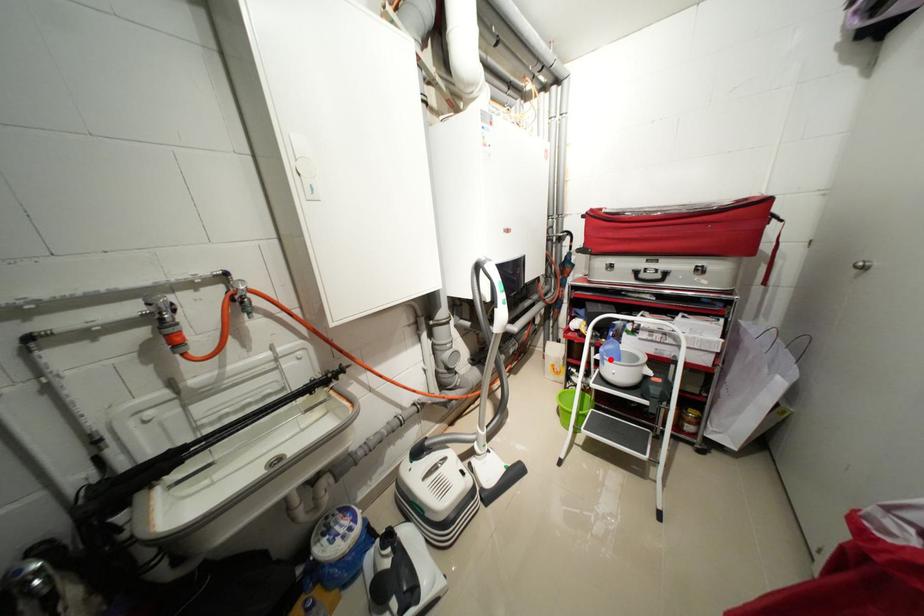
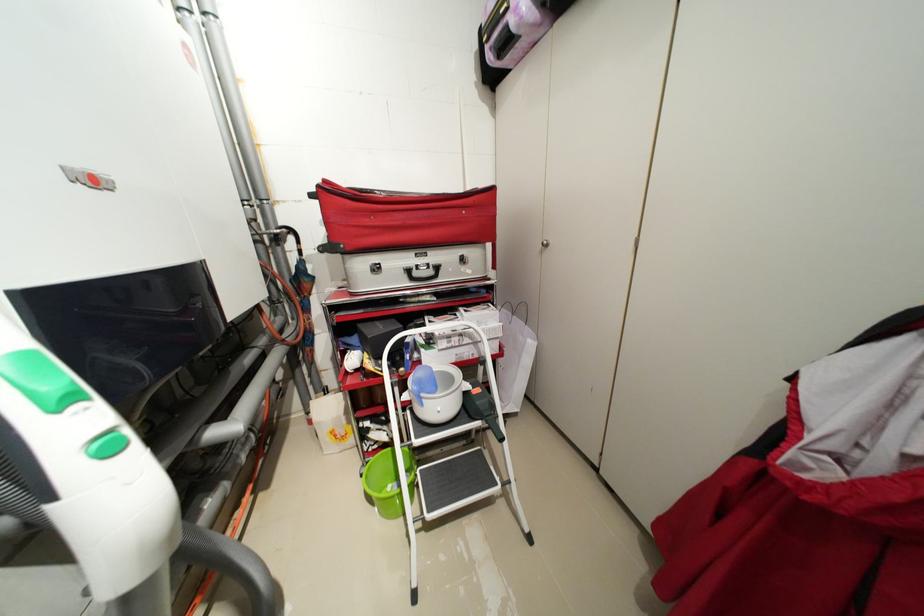
Where in the second image is the point corresponding to the highlighted location from the first image?

(428, 400)